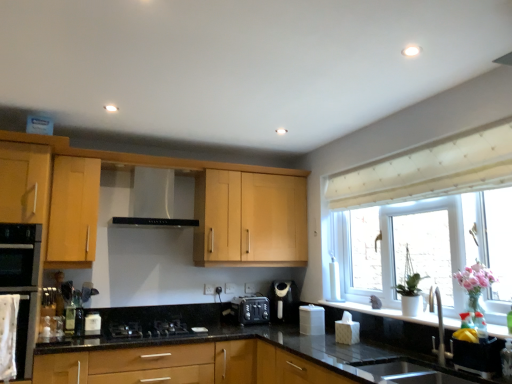
The height and width of the screenshot is (384, 512). Describe the element at coordinates (472, 352) in the screenshot. I see `black granite sink at lower center, positioned as the 1th sink in bottom-to-top order` at that location.

Measure the distance between point [173,189] and camera.

Point [173,189] is 3.41 meters away from camera.

At what (x,y) coordinates should I click in order to perform the action: click on white matte window sill at lower right. Please return your answer as a coordinate pair (x, y). Looking at the image, I should click on point(383,312).

Image resolution: width=512 pixels, height=384 pixels. What are the coordinates of `black granite sink at lower center, positioned as the 1th sink in bottom-to-top order` in the screenshot? It's located at (472, 352).

Is translucent glass bottle at lower left oriented towards black matte oven at left?

No, translucent glass bottle at lower left is not oriented towards black matte oven at left.

Choose the correct answer: Is translucent glass bottle at lower left inside black matte oven at left or outside it?

translucent glass bottle at lower left is not inside black matte oven at left, it's outside.

Between translucent glass bottle at lower left and black matte oven at left, which one has less height?

translucent glass bottle at lower left.

Which point is more distant from viewer, (71, 333) or (14, 288)?

The point (71, 333) is farther from the camera.

Would you say black granite countertop at center is to the left or to the right of black matte gas stove at center in the picture?

Based on their positions, black granite countertop at center is located to the right of black matte gas stove at center.

Does black granite countertop at center have a greater width compared to black matte gas stove at center?

Yes.

Identify the location of gas stove on the left of black granite countertop at center. (147, 329).

From the image's perspective, does black granite countertop at center appear lower than black matte gas stove at center?

Indeed, from the image's perspective, black granite countertop at center is shown beneath black matte gas stove at center.

Which is behind, white plastic window at center or black matte exhaust hood at center?

black matte exhaust hood at center.

From a real-world perspective, which is physically below, white plastic window at center or black matte exhaust hood at center?

white plastic window at center.

Where is `exhaust hood above the white plastic window at center (from a real-world perspective)`? The image size is (512, 384). exhaust hood above the white plastic window at center (from a real-world perspective) is located at coordinates [x=154, y=200].

Is white plastic window at center wider than black matte exhaust hood at center?

No.

How much distance is there between black matte gas stove at center and white plastic window at center?

5.79 feet.

Is black matte gas stove at center to the left of white plastic window at center from the viewer's perspective?

Indeed, black matte gas stove at center is positioned on the left side of white plastic window at center.

Which of these two, black matte gas stove at center or white plastic window at center, is bigger?

white plastic window at center is bigger.

Is translucent glass bottle at lower left wider than black matte gas stove at center?

In fact, translucent glass bottle at lower left might be narrower than black matte gas stove at center.

From the image's perspective, is translucent glass bottle at lower left over black matte gas stove at center?

Correct, translucent glass bottle at lower left appears higher than black matte gas stove at center in the image.

Identify the location of gas stove below the translucent glass bottle at lower left (from the image's perspective). (147, 329).

Considering the relative sizes of satin black coffee machine at center and pink glass vase at right in the image provided, is satin black coffee machine at center shorter than pink glass vase at right?

Yes, satin black coffee machine at center is shorter than pink glass vase at right.

Which of these two, satin black coffee machine at center or pink glass vase at right, is smaller?

Smaller between the two is pink glass vase at right.

From a real-world perspective, is satin black coffee machine at center over pink glass vase at right?

No, from a real-world perspective, satin black coffee machine at center is not over pink glass vase at right

Would you say pink glass vase at right is part of satin black coffee machine at center's contents?

Actually, pink glass vase at right is outside satin black coffee machine at center.

Is black matte oven at left aimed at black matte gas stove at center?

No, black matte oven at left is not facing towards black matte gas stove at center.

Which object is further away from the camera taking this photo, black matte oven at left or black matte gas stove at center?

black matte gas stove at center is behind.

This screenshot has width=512, height=384. What are the coordinates of `gas stove behind the black matte oven at left` in the screenshot? It's located at (147, 329).

Is black matte oven at left wider than black matte gas stove at center?

In fact, black matte oven at left might be narrower than black matte gas stove at center.

At what (x,y) coordinates should I click in order to perform the action: click on bottle that appears below the black matte oven at left (from the image's perspective). Please return your answer as a coordinate pair (x, y). This screenshot has height=384, width=512. Looking at the image, I should click on (71, 313).

At what (x,y) coordinates should I click in order to perform the action: click on gas stove above the black granite countertop at center (from a real-world perspective). Please return your answer as a coordinate pair (x, y). Looking at the image, I should click on (147, 329).

Looking at the image, which one is located closer to black matte exhaust hood at center, black plastic toaster at center or satin black coffee machine at center?

black plastic toaster at center lies closer to black matte exhaust hood at center than the other object.

Based on the photo, estimate the real-world distances between objects in this image. Which object is closer to black plastic toaster at center, white plastic window at center or white matte window sill at lower right?

white matte window sill at lower right is closer to black plastic toaster at center.

Consider the image. From the image, which object appears to be farther from black granite sink at lower center, the second sink from the top, pink glass vase at right or black matte exhaust hood at center?

black matte exhaust hood at center lies further to black granite sink at lower center, the second sink from the top, than the other object.

Consider the image. When comparing their distances from black granite sink at lower center, positioned as the 1th sink in bottom-to-top order, does black matte oven at left or white plastic window at center seem further?

Based on the image, black matte oven at left appears to be further to black granite sink at lower center, positioned as the 1th sink in bottom-to-top order.

Based on their spatial positions, is black granite sink at lower center, positioned as the 1th sink in bottom-to-top order, or black plastic toaster at center closer to white plastic tissue box at lower right?

black plastic toaster at center.

Estimate the real-world distances between objects in this image. Which object is closer to black granite countertop at center, black granite sink at lower center, positioned as the 1th sink in bottom-to-top order, or satin black coffee machine at center?

black granite sink at lower center, positioned as the 1th sink in bottom-to-top order, is positioned closer to the anchor black granite countertop at center.

Based on their spatial positions, is satin black coffee machine at center or black matte gas stove at center further from black granite countertop at center?

satin black coffee machine at center is further to black granite countertop at center.

Which object lies nearer to the anchor point light wood cabinet at center, translucent glass bottle at lower left or white matte window sill at lower right?

The object closer to light wood cabinet at center is translucent glass bottle at lower left.

I want to click on exhaust hood between translucent glass bottle at lower left and black glossy sink at lower right, which is the second sink in bottom-to-top order, so click(x=154, y=200).

Locate an element on the screen. The height and width of the screenshot is (384, 512). floral arrangement between black granite sink at lower center, the second sink from the top, and white plastic tissue box at lower right from front to back is located at coordinates (475, 284).

Where is `cabinetry between black matte gas stove at center and black glossy sink at lower right, the first sink when ordered from top to bottom, in the horizontal direction`? Image resolution: width=512 pixels, height=384 pixels. cabinetry between black matte gas stove at center and black glossy sink at lower right, the first sink when ordered from top to bottom, in the horizontal direction is located at coordinates (141, 156).

The width and height of the screenshot is (512, 384). In order to click on sink located between black granite countertop at center and black glossy sink at lower right, the first sink when ordered from top to bottom, in the depth direction in this screenshot , I will do `click(472, 352)`.